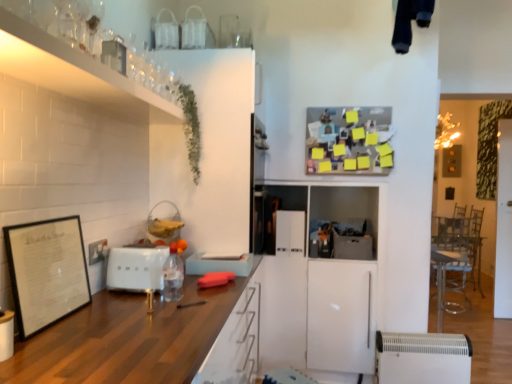
Question: Considering the relative sizes of wooden countertop at center, which ranks as the first cabinetry in bottom-to-top order, and clear plastic bottle at center in the image provided, is wooden countertop at center, which ranks as the first cabinetry in bottom-to-top order, thinner than clear plastic bottle at center?

Choices:
 (A) no
 (B) yes

Answer: (A)

Question: Does wooden countertop at center, acting as the 2th cabinetry starting from the top, have a lesser height compared to clear plastic bottle at center?

Choices:
 (A) yes
 (B) no

Answer: (B)

Question: From the image's perspective, is wooden countertop at center, which ranks as the first cabinetry in bottom-to-top order, on top of clear plastic bottle at center?

Choices:
 (A) no
 (B) yes

Answer: (A)

Question: From the image's perspective, is wooden countertop at center, acting as the 2th cabinetry starting from the top, below clear plastic bottle at center?

Choices:
 (A) no
 (B) yes

Answer: (B)

Question: Is wooden countertop at center, which ranks as the first cabinetry in bottom-to-top order, positioned in front of clear plastic bottle at center?

Choices:
 (A) yes
 (B) no

Answer: (A)

Question: Considering the positions of white matte toaster at center, the first appliance from the front, and clear plastic bottle at center in the image, is white matte toaster at center, the first appliance from the front, wider or thinner than clear plastic bottle at center?

Choices:
 (A) thin
 (B) wide

Answer: (B)

Question: From a real-world perspective, relative to clear plastic bottle at center, is white matte toaster at center, the second appliance viewed from the top, vertically above or below?

Choices:
 (A) above
 (B) below

Answer: (B)

Question: Considering the positions of point (144, 248) and point (173, 286), is point (144, 248) closer or farther from the camera than point (173, 286)?

Choices:
 (A) closer
 (B) farther

Answer: (B)

Question: Based on their positions, is white matte toaster at center, which ranks as the first appliance in left-to-right order, located to the left or right of clear plastic bottle at center?

Choices:
 (A) right
 (B) left

Answer: (B)

Question: Considering their positions, is white glossy refrigerator at center, which appears as the fourth appliance when viewed from the front, located in front of or behind clear glass shelf at upper left, acting as the 2th cabinetry starting from the bottom?

Choices:
 (A) behind
 (B) front

Answer: (A)

Question: Is white glossy refrigerator at center, acting as the 1th appliance starting from the back, inside the boundaries of clear glass shelf at upper left, acting as the 2th cabinetry starting from the bottom, or outside?

Choices:
 (A) inside
 (B) outside

Answer: (B)

Question: From their relative heights in the image, would you say white glossy refrigerator at center, which appears as the fourth appliance when viewed from the front, is taller or shorter than clear glass shelf at upper left, acting as the 2th cabinetry starting from the bottom?

Choices:
 (A) short
 (B) tall

Answer: (B)

Question: From a real-world perspective, relative to clear glass shelf at upper left, acting as the 2th cabinetry starting from the bottom, is white glossy refrigerator at center, acting as the 1th appliance starting from the back, vertically above or below?

Choices:
 (A) above
 (B) below

Answer: (B)

Question: Looking at the image, does white glossy refrigerator at center, acting as the 1th appliance starting from the back, seem bigger or smaller compared to green leafy plant at upper left?

Choices:
 (A) big
 (B) small

Answer: (B)

Question: Based on their positions, is white glossy refrigerator at center, placed as the 4th appliance when sorted from bottom to top, located to the left or right of green leafy plant at upper left?

Choices:
 (A) right
 (B) left

Answer: (A)